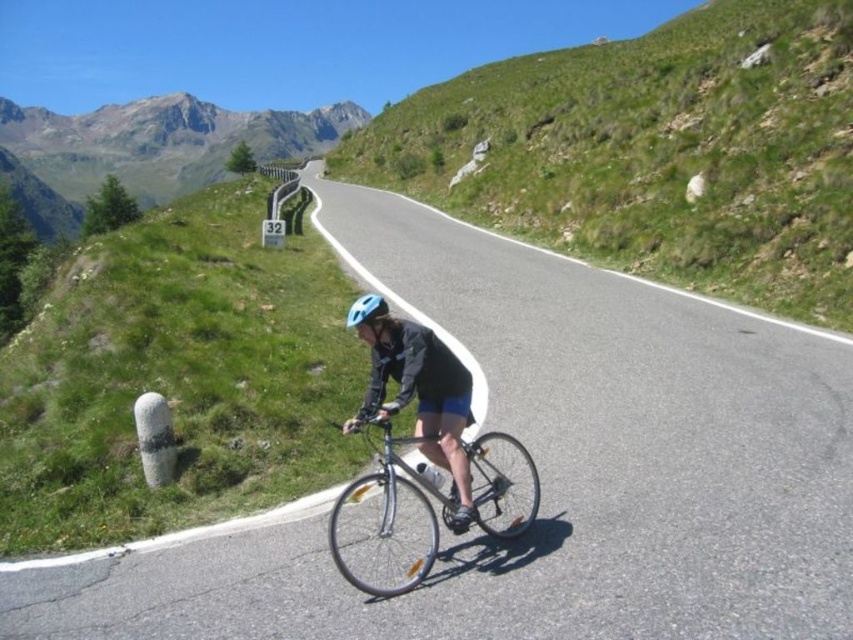
You are a drone operator trying to capture the cyclist on the mountain road. You have two points marked on your screen, point (338,134) and point (386,307). Which point is closer to the cyclist?

Point (338,134) is further to the viewer than point (386,307), so the closer point to the cyclist would be point (386,307).

In the scene shown: You are the cyclist in the image, and you need to check if your matte blue helmet at center is visible from the rugged granite mountain at upper left. Based on their positions, can you see your helmet from the mountain?

The rugged granite mountain at upper left is above the matte blue helmet at center, so if you were at the mountain, you would be looking downward toward the helmet, making it potentially visible depending on the line of sight and any obstructions.